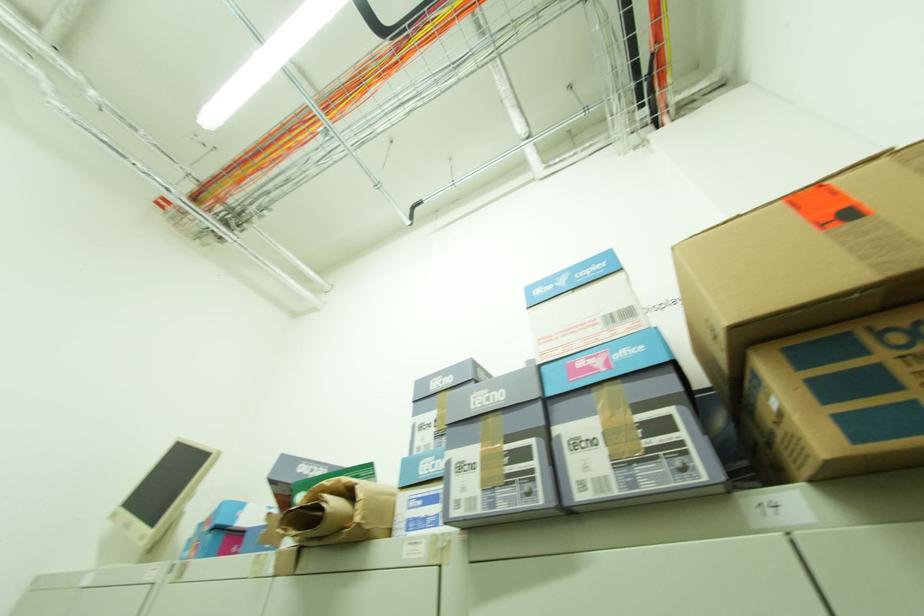
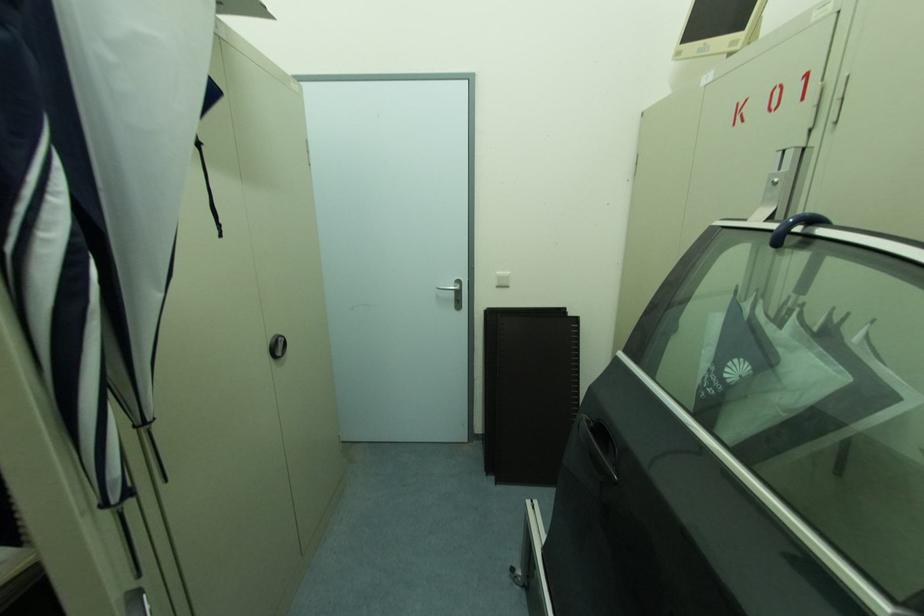
First-person continuous shooting, in which direction is the camera rotating?

The rotation direction of the camera is left-down.